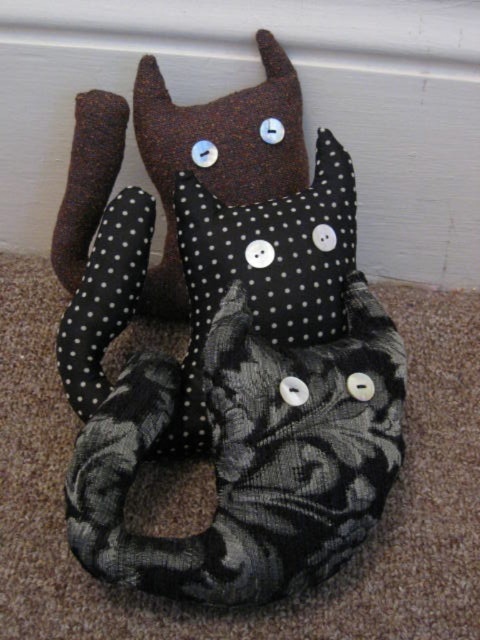
Question: Which object is closer to the camera taking this photo?

Choices:
 (A) black dotted fabric pillow at center
 (B) black dotted fabric cat at center

Answer: (B)

Question: Is black dotted fabric cat at center thinner than black dotted fabric pillow at center?

Choices:
 (A) no
 (B) yes

Answer: (A)

Question: Does black dotted fabric cat at center come in front of black dotted fabric pillow at center?

Choices:
 (A) yes
 (B) no

Answer: (A)

Question: Is black dotted fabric cat at center to the right of black dotted fabric pillow at center from the viewer's perspective?

Choices:
 (A) yes
 (B) no

Answer: (B)

Question: Among these objects, which one is farthest from the camera?

Choices:
 (A) black dotted fabric pillow at center
 (B) black dotted fabric cat at center

Answer: (A)

Question: Which of the following is the farthest from the observer?

Choices:
 (A) black dotted fabric pillow at center
 (B) black dotted fabric cat at center

Answer: (A)